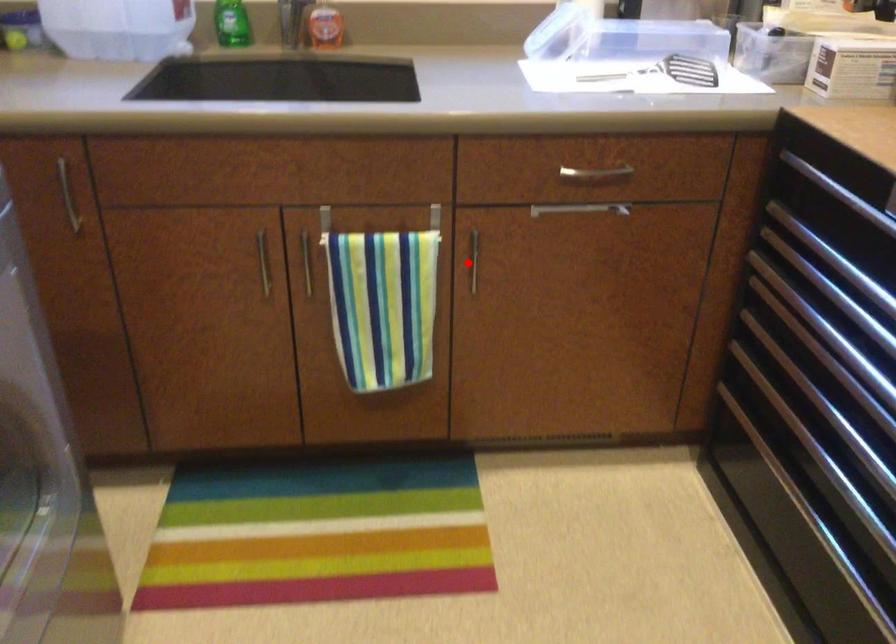
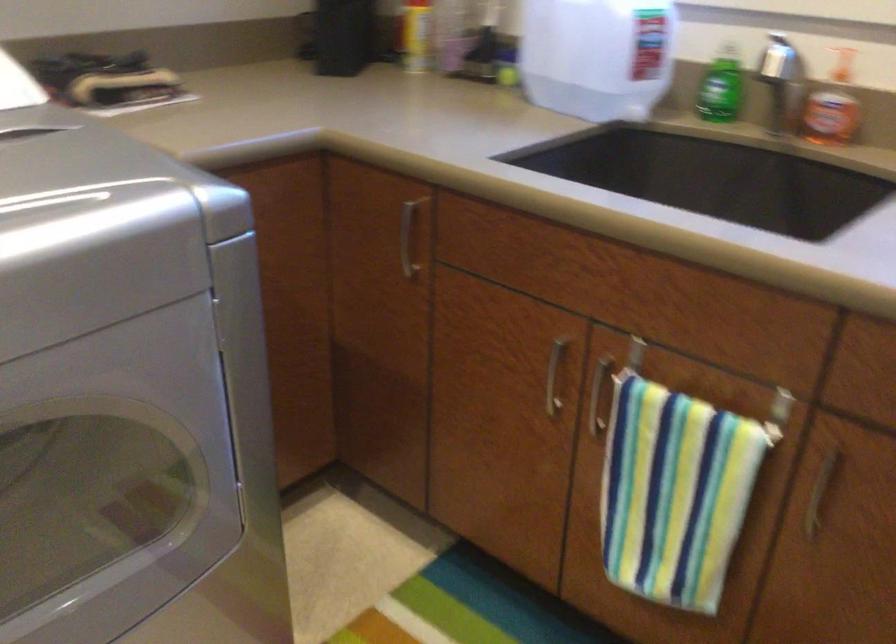
The point at the highlighted location is marked in the first image. Where is the corresponding point in the second image?

(819, 494)